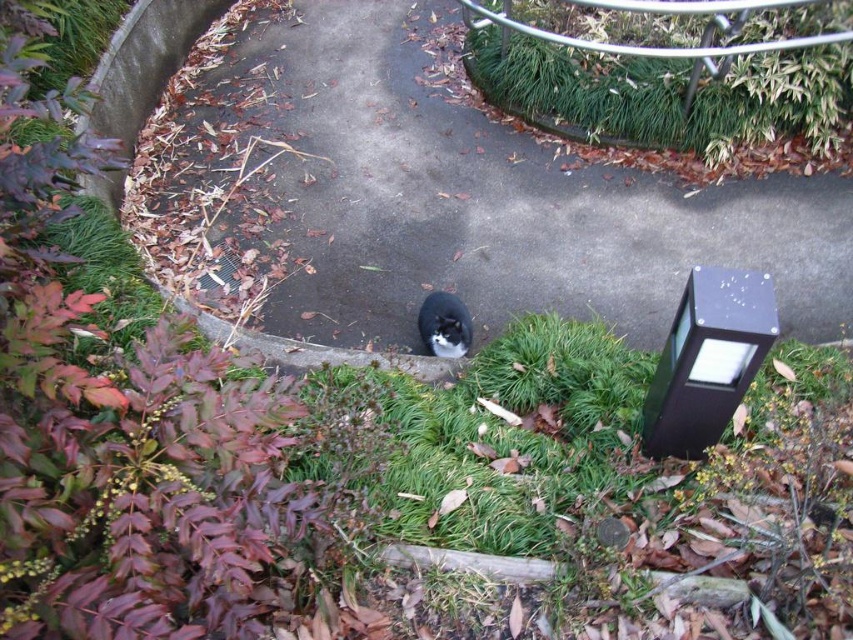
Question: Does leaves at lower left appear on the left side of black fur cat at center?

Choices:
 (A) no
 (B) yes

Answer: (B)

Question: Can you confirm if leaves at lower left is positioned to the left of green grass at upper center?

Choices:
 (A) no
 (B) yes

Answer: (B)

Question: Which point is farther from the camera taking this photo?

Choices:
 (A) (442, 305)
 (B) (785, 35)

Answer: (B)

Question: Which object is farther from the camera taking this photo?

Choices:
 (A) black fur cat at center
 (B) leaves at lower left

Answer: (A)

Question: Does green grass at upper center come behind black fur cat at center?

Choices:
 (A) yes
 (B) no

Answer: (A)

Question: Among these objects, which one is nearest to the camera?

Choices:
 (A) green grass at upper center
 (B) leaves at lower left

Answer: (B)